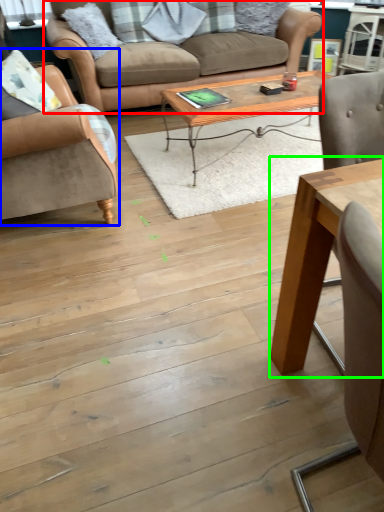
Question: Which object is the farthest from studio couch (highlighted by a red box)? Choose among these: chair (highlighted by a blue box) or coffee table (highlighted by a green box).

Choices:
 (A) chair
 (B) coffee table

Answer: (B)